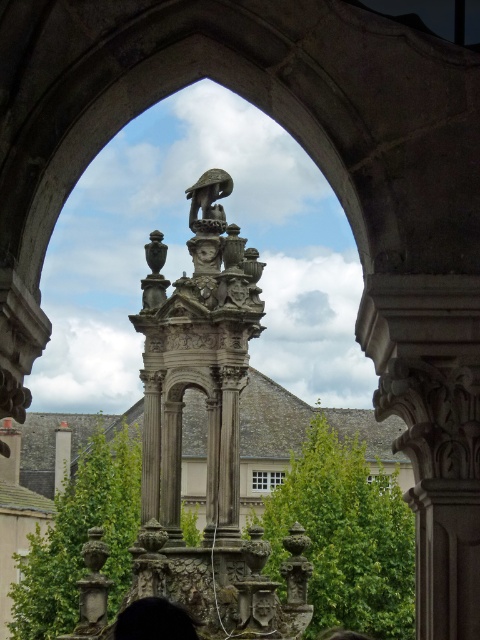
Measure the distance between shiny bronze bird at center and camera.

They are 110.35 meters apart.

Does point (213, 212) come farther from viewer compared to point (68, 429)?

No, it is not.

I want to click on shiny bronze bird at center, so click(x=208, y=195).

Who is taller, black hair at lower center or shiny bronze bird at center?

shiny bronze bird at center is taller.

Is black hair at lower center to the left of shiny bronze bird at center from the viewer's perspective?

Indeed, black hair at lower center is positioned on the left side of shiny bronze bird at center.

Between point (190, 632) and point (214, 224), which one is positioned in front?

Point (190, 632) is more forward.

The image size is (480, 640). I want to click on black hair at lower center, so click(x=154, y=620).

Between black hair at lower center and white marble pillar at center, which one appears on the left side from the viewer's perspective?

white marble pillar at center is more to the left.

Based on the photo, who is more distant from viewer, (163, 604) or (64, 424)?

Point (64, 424)

What do you see at coordinates (154, 620) in the screenshot? The width and height of the screenshot is (480, 640). I see `black hair at lower center` at bounding box center [154, 620].

What are the coordinates of `black hair at lower center` in the screenshot? It's located at (154, 620).